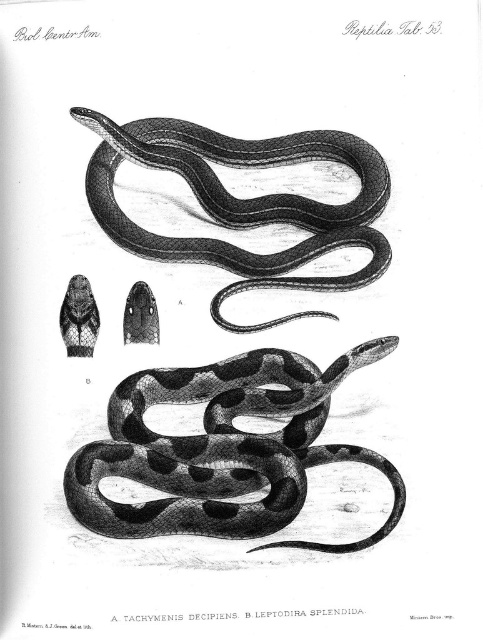
You are a biologist studying the snakes in the image. You need to determine which snake is longer. The image shows a black textured snake at center and a smooth black snake at center. Which one is longer?

The smooth black snake at center is longer than the black textured snake at center.

You are a researcher examining the illustration labeled as Reptilia Tab. 53 from the journal Biol. Centr.Am. You notice the black textured snake at center. Can you provide its exact coordinates as depicted in the illustration?

The position of black textured snake at center is at point (223, 449).